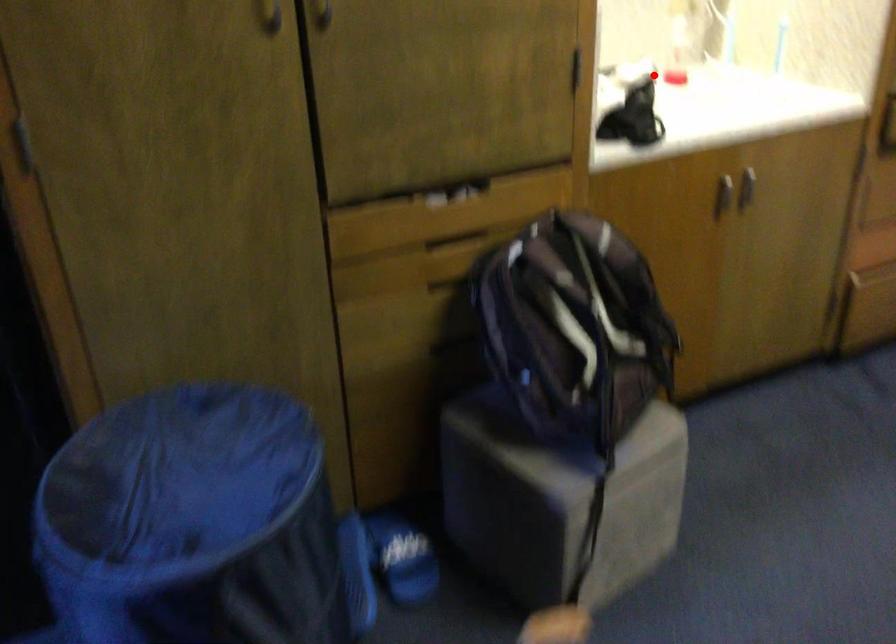
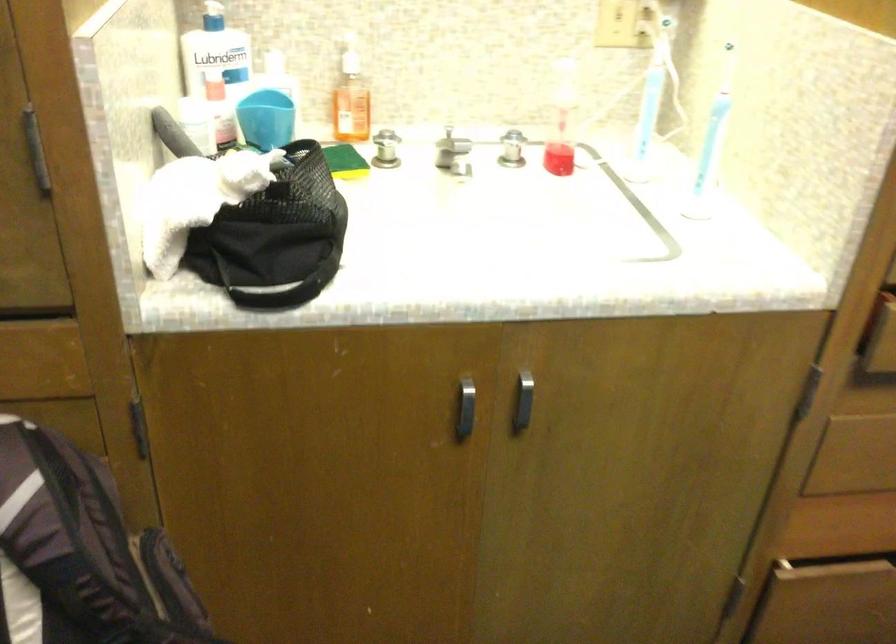
In the second image, find the point that corresponds to the highlighted location in the first image.

(512, 149)